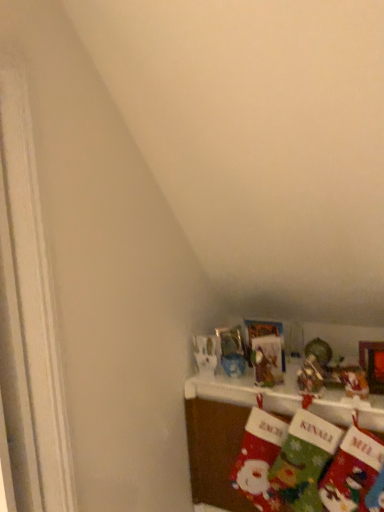
Question: Is shiny metallic ornament at upper right, the 2th toy in the left-to-right sequence, to the left or to the right of velvet christmas stockings at lower right in the image?

Choices:
 (A) left
 (B) right

Answer: (B)

Question: From their relative heights in the image, would you say shiny metallic ornament at upper right, the 2th toy in the left-to-right sequence, is taller or shorter than velvet christmas stockings at lower right?

Choices:
 (A) short
 (B) tall

Answer: (A)

Question: Which object is positioned closest to the shiny metallic ornament at upper right, which is the 1th toy from right to left?

Choices:
 (A) green felt stocking at lower right, placed as the 3th sock when sorted from left to right
 (B) red felt stocking at lower right, acting as the 1th sock starting from the left
 (C) velvet christmas stockings at lower right
 (D) red felt stocking at lower right, placed as the 2th sock when sorted from left to right
 (E) metallic silver ornament at upper center, the 1th toy in the left-to-right sequence

Answer: (E)

Question: Based on their relative distances, which object is farther from the red felt stocking at lower right, placed as the 2th sock when sorted from left to right?

Choices:
 (A) green felt stocking at lower right, placed as the 3th sock when sorted from left to right
 (B) shiny metallic ornament at upper right, the 2th toy in the left-to-right sequence
 (C) velvet christmas stockings at lower right
 (D) red felt stocking at lower right, acting as the 1th sock starting from the left
 (E) metallic silver ornament at upper center, the 2th toy from the right

Answer: (B)